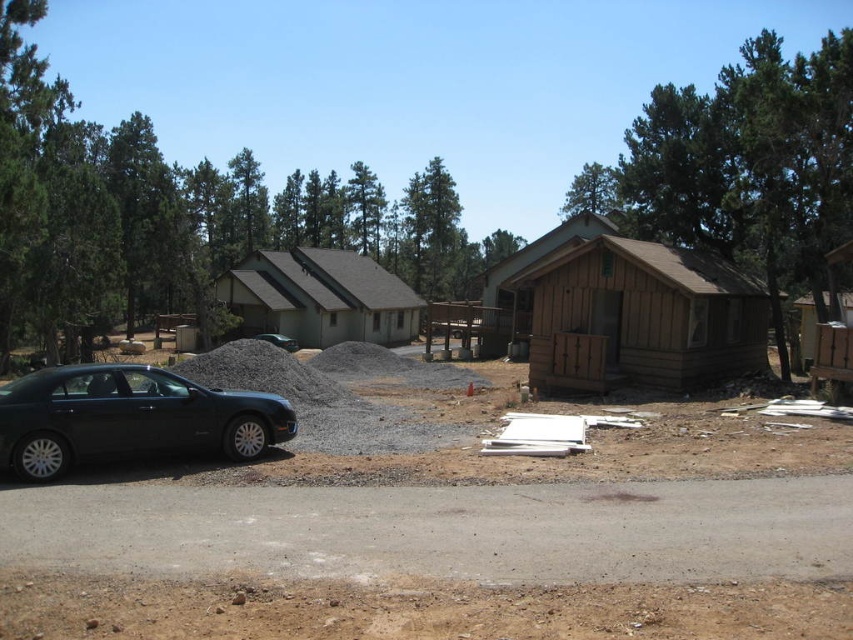
You are a delivery driver who needs to back up your truck from the brown dirt track at lower center to the black matte sedan at left. Can you do this without hitting the sedan if your truck requires 7 meters of space to maneuver?

The distance between the brown dirt track at lower center and the black matte sedan at left is 6.44 meters. Since the truck needs 7 meters to maneuver, it is not enough space. Therefore, you cannot safely back up without hitting the sedan.

You are a delivery driver who needs to drive a truck that is 2 meters wide to the green shingled cabin at center. The brown dirt track at lower center is the only path available. Can the truck pass through the track?

The brown dirt track at lower center has a smaller size compared to green shingled cabin at center. Since the track is narrower than the cabin, it might not be wide enough for a 2 meter wide truck. However, the description only mentions the track is smaller in size relative to the cabin, but does not specify the exact width. Without knowing the actual dimensions of the track, it is uncertain if the truck can pass safely.

You are a delivery driver who needs to reach the green shingled cabin at center. Your truck has a maximum load capacity of 5 tons and can handle rough terrain up to 50 meters. The brown dirt track at lower center is the only accessible path. Can your truck safely reach the cabin without exceeding its load capacity or terrain limits?

The distance between the brown dirt track at lower center and the green shingled cabin at center is 49.44 meters. Since the truck can handle rough terrain up to 50 meters, it can safely reach the cabin without exceeding its terrain limit. However, the question about load capacity isn